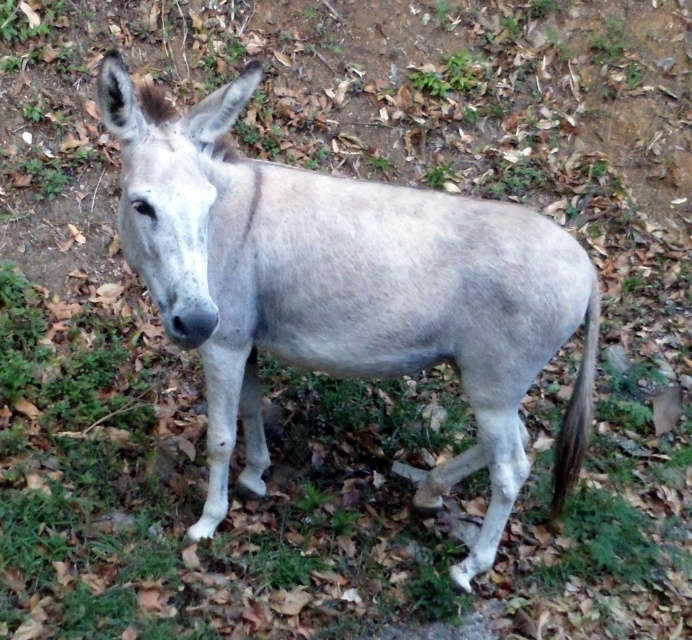
Question: Among these points, which one is farthest from the camera?

Choices:
 (A) (585, 404)
 (B) (158, 188)

Answer: (A)

Question: Can you confirm if gray matte mule at center is bigger than gray matte tail at lower right?

Choices:
 (A) yes
 (B) no

Answer: (A)

Question: Is gray matte mule at center positioned at the back of gray matte tail at lower right?

Choices:
 (A) yes
 (B) no

Answer: (B)

Question: Which point appears farthest from the camera in this image?

Choices:
 (A) (567, 307)
 (B) (592, 314)

Answer: (B)

Question: Can you confirm if gray matte mule at center is positioned below gray matte tail at lower right?

Choices:
 (A) no
 (B) yes

Answer: (A)